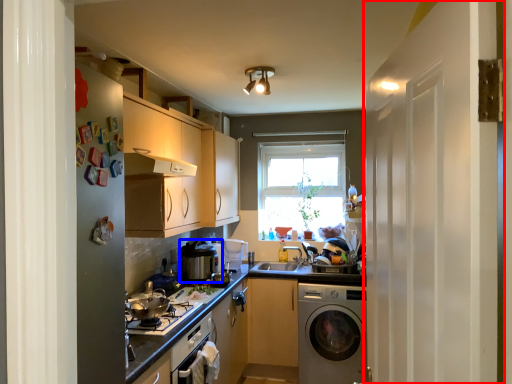
Question: Which object appears farthest to the camera in this image, screen door (highlighted by a red box) or appliance (highlighted by a blue box)?

Choices:
 (A) screen door
 (B) appliance

Answer: (B)